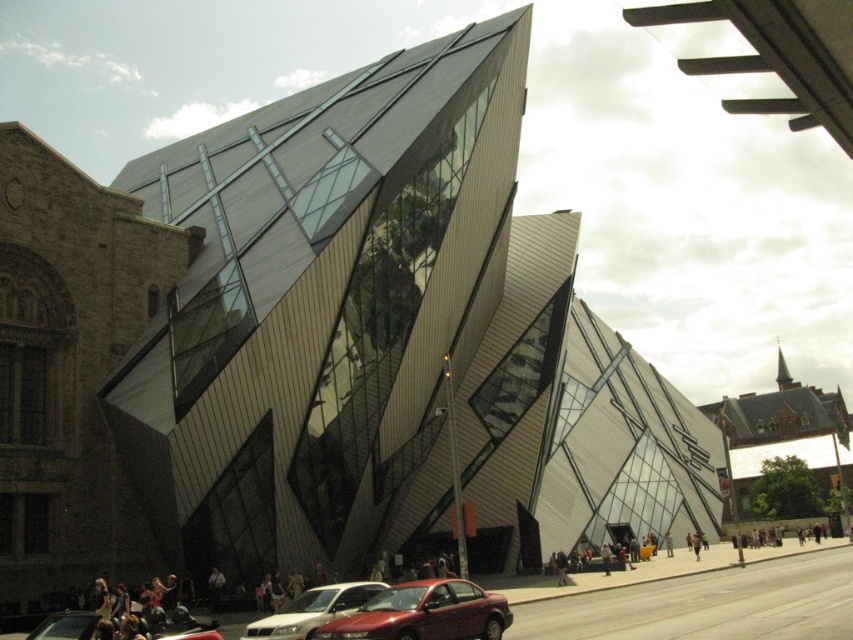
Does matte white sedan at lower center have a greater height compared to metallic red car at lower center?

Yes.

Who is shorter, matte white sedan at lower center or metallic red car at lower center?

metallic red car at lower center is shorter.

Which is in front, point (311, 627) or point (165, 621)?

Point (311, 627) is in front.

Identify the location of matte white sedan at lower center. The height and width of the screenshot is (640, 853). (312, 611).

Does shiny red sedan at center come behind metallic red car at lower center?

That is True.

Can you confirm if shiny red sedan at center is wider than metallic red car at lower center?

No, shiny red sedan at center is not wider than metallic red car at lower center.

This screenshot has height=640, width=853. What are the coordinates of `shiny red sedan at center` in the screenshot? It's located at click(424, 612).

Who is more distant from viewer, (457,580) or (349,609)?

The point (457,580) is behind.

Is point (396, 637) positioned before point (376, 588)?

That is True.

Is point (447, 636) positioned behind point (302, 616)?

No, it is not.

Locate an element on the screen. The image size is (853, 640). shiny red sedan at center is located at coordinates (424, 612).